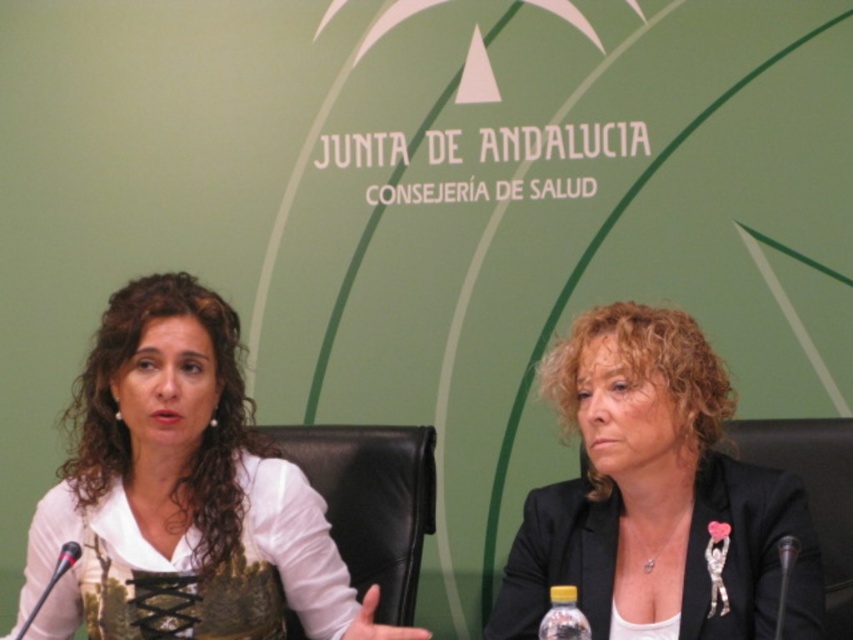
Question: Among these points, which one is farthest from the camera?

Choices:
 (A) (48, 582)
 (B) (146, 296)

Answer: (B)

Question: Can you confirm if black leather chair at center is smaller than black plastic microphone at right?

Choices:
 (A) no
 (B) yes

Answer: (A)

Question: From the image, what is the correct spatial relationship of white lace blouse at center in relation to translucent plastic bottle at lower center?

Choices:
 (A) right
 (B) left

Answer: (B)

Question: Which of the following is the closest to the observer?

Choices:
 (A) (555, 621)
 (B) (355, 512)
 (C) (582, 410)
 (D) (20, 630)

Answer: (A)

Question: Does white lace blouse at center appear under metallic silver microphone at lower left?

Choices:
 (A) yes
 (B) no

Answer: (B)

Question: Which object appears farthest from the camera in this image?

Choices:
 (A) metallic silver microphone at lower left
 (B) translucent plastic bottle at lower center

Answer: (A)